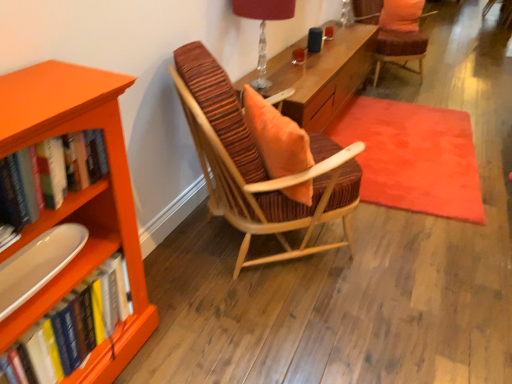
Locate an element on the screen. free space in front of velvet orange rug at center is located at coordinates (391, 274).